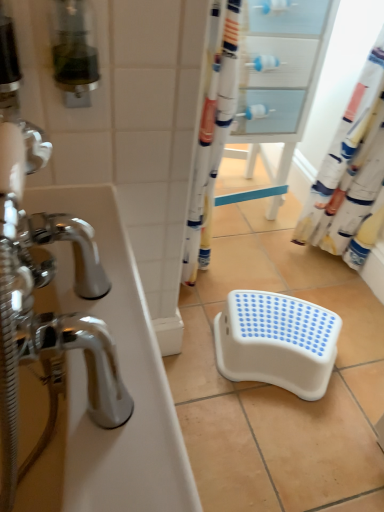
Identify the location of white fabric shower curtain at right. (342, 149).

Image resolution: width=384 pixels, height=512 pixels. What do you see at coordinates (277, 83) in the screenshot? I see `white glossy drawer at upper center` at bounding box center [277, 83].

This screenshot has width=384, height=512. I want to click on white fabric shower curtain at right, so click(x=342, y=149).

Who is taller, white plastic step stool at center or white glossy drawer at upper center?

white glossy drawer at upper center is taller.

Is white plastic step stool at center oriented towards white glossy drawer at upper center?

No, white plastic step stool at center is not facing towards white glossy drawer at upper center.

Can white glossy drawer at upper center be found inside white plastic step stool at center?

No.

Which is behind, point (257, 372) or point (296, 58)?

Point (296, 58)

From the picture: Can you confirm if white glossy drawer at upper center is positioned to the left of white fabric shower curtain at right?

Indeed, white glossy drawer at upper center is positioned on the left side of white fabric shower curtain at right.

Does point (241, 79) lie behind point (322, 221)?

No.

In terms of size, does white glossy drawer at upper center appear bigger or smaller than white fabric shower curtain at right?

Clearly, white glossy drawer at upper center is larger in size than white fabric shower curtain at right.

Would you consider white glossy drawer at upper center to be distant from white fabric shower curtain at right?

They are positioned close to each other.

Based on the photo, how far apart are white glossy drawer at upper center and white plastic step stool at center?

white glossy drawer at upper center and white plastic step stool at center are 64.35 centimeters apart.

Can you confirm if white glossy drawer at upper center is taller than white plastic step stool at center?

Indeed, white glossy drawer at upper center has a greater height compared to white plastic step stool at center.

Looking at this image, is white glossy drawer at upper center oriented away from white plastic step stool at center?

No, white glossy drawer at upper center is not facing the opposite direction of white plastic step stool at center.

Identify the location of screen door that appears above the white plastic step stool at center (from the image's perspective). This screenshot has width=384, height=512. (277, 83).

From a real-world perspective, is white fabric shower curtain at right under white glossy drawer at upper center?

No, from a real-world perspective, white fabric shower curtain at right is not beneath white glossy drawer at upper center.

Looking at this image, is white fabric shower curtain at right at the right side of white glossy drawer at upper center?

Correct, you'll find white fabric shower curtain at right to the right of white glossy drawer at upper center.

Would you say white fabric shower curtain at right is inside or outside white glossy drawer at upper center?

white fabric shower curtain at right cannot be found inside white glossy drawer at upper center.

Is white fabric shower curtain at right facing towards white glossy drawer at upper center?

No, white fabric shower curtain at right is not turned towards white glossy drawer at upper center.

Where is `bath on the left side of white fabric shower curtain at right`? This screenshot has height=512, width=384. bath on the left side of white fabric shower curtain at right is located at coordinates (123, 380).

Does white fabric shower curtain at right have a lesser width compared to white glossy bathtub at left?

Indeed, white fabric shower curtain at right has a lesser width compared to white glossy bathtub at left.

From the image's perspective, is white fabric shower curtain at right above white glossy bathtub at left?

Yes.

Can you tell me how much white fabric shower curtain at right and white glossy bathtub at left differ in facing direction?

The angle between the facing direction of white fabric shower curtain at right and the facing direction of white glossy bathtub at left is 90.7 degrees.

In the image, is white glossy bathtub at left on the left side or the right side of white glossy drawer at upper center?

white glossy bathtub at left is positioned on white glossy drawer at upper center's left side.

What's the angular difference between white glossy bathtub at left and white glossy drawer at upper center's facing directions?

86.7 degrees.

In terms of width, does white glossy bathtub at left look wider or thinner when compared to white glossy drawer at upper center?

Considering their sizes, white glossy bathtub at left looks slimmer than white glossy drawer at upper center.

Based on the photo, from the image's perspective, is white glossy bathtub at left positioned above or below white glossy drawer at upper center?

Clearly, from the image's perspective, white glossy bathtub at left is below white glossy drawer at upper center.

Between white plastic step stool at center and white glossy bathtub at left, which one has smaller width?

white glossy bathtub at left is thinner.

Is white plastic step stool at center in contact with white glossy bathtub at left?

No.

From a real-world perspective, is white plastic step stool at center physically above white glossy bathtub at left?

Incorrect, from a real-world perspective, white plastic step stool at center is lower than white glossy bathtub at left.

Is the position of white plastic step stool at center more distant than that of white glossy bathtub at left?

That is True.

The width and height of the screenshot is (384, 512). In order to click on step stool on the right of white glossy drawer at upper center in this screenshot , I will do `click(276, 342)`.

This screenshot has height=512, width=384. In order to click on screen door that is on the left side of white fabric shower curtain at right in this screenshot , I will do `click(277, 83)`.

Looking at the image, which one is located closer to white plastic step stool at center, white glossy bathtub at left or white fabric shower curtain at right?

Based on the image, white fabric shower curtain at right appears to be nearer to white plastic step stool at center.

From the image, which object appears to be nearer to white fabric shower curtain at right, white glossy bathtub at left or white glossy drawer at upper center?

white glossy drawer at upper center lies closer to white fabric shower curtain at right than the other object.

Looking at the image, which one is located further to white fabric shower curtain at right, white glossy drawer at upper center or white plastic step stool at center?

The object further to white fabric shower curtain at right is white plastic step stool at center.

From the image, which object appears to be farther from white glossy bathtub at left, white glossy drawer at upper center or white plastic step stool at center?

white glossy drawer at upper center is positioned further to the anchor white glossy bathtub at left.

Based on their spatial positions, is white plastic step stool at center or white glossy bathtub at left closer to white glossy drawer at upper center?

Based on the image, white plastic step stool at center appears to be nearer to white glossy drawer at upper center.

Consider the image. When comparing their distances from white fabric shower curtain at right, does white plastic step stool at center or white glossy bathtub at left seem further?

Among the two, white glossy bathtub at left is located further to white fabric shower curtain at right.

Which object lies further to the anchor point white glossy drawer at upper center, white glossy bathtub at left or white fabric shower curtain at right?

white glossy bathtub at left is further to white glossy drawer at upper center.

Estimate the real-world distances between objects in this image. Which object is closer to white fabric shower curtain at right, white plastic step stool at center or white glossy drawer at upper center?

Among the two, white glossy drawer at upper center is located nearer to white fabric shower curtain at right.

Identify the location of step stool between white glossy bathtub at left and white glossy drawer at upper center along the z-axis. The width and height of the screenshot is (384, 512). (276, 342).

The image size is (384, 512). Identify the location of shower curtain between white glossy bathtub at left and white plastic step stool at center along the z-axis. (342, 149).

The width and height of the screenshot is (384, 512). In order to click on shower curtain between white glossy drawer at upper center and white plastic step stool at center in the up-down direction in this screenshot , I will do `click(342, 149)`.

Where is `shower curtain located between white glossy bathtub at left and white glossy drawer at upper center in the depth direction`? This screenshot has width=384, height=512. shower curtain located between white glossy bathtub at left and white glossy drawer at upper center in the depth direction is located at coordinates (342, 149).